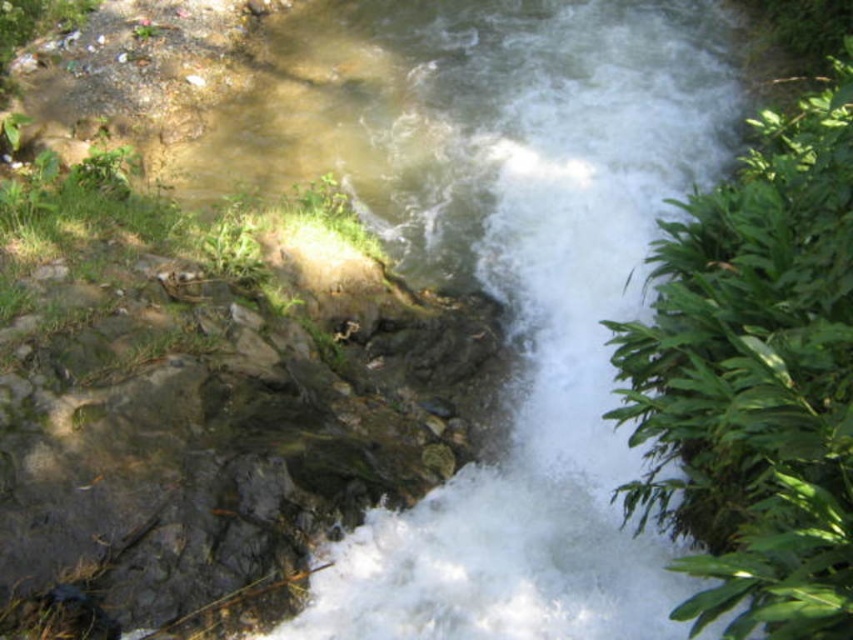
You are a photographer standing at the edge of the stream. You want to capture a closeup shot of the clear water at center without getting your equipment wet. Based on the scene description, can you safely stand where you are and take the photo?

The clear water at center is 11.84 feet away from the camera. Since this distance is more than enough to keep your equipment dry while taking the closeup shot, you can safely stand where you are and capture the photo.

You are standing at the point marked by the coordinates point (502, 276) in the image. Based on the scene description provided, what would you most likely observe around you?

The point (502, 276) indicates clear water at center, so you would most likely observe clear water around you.